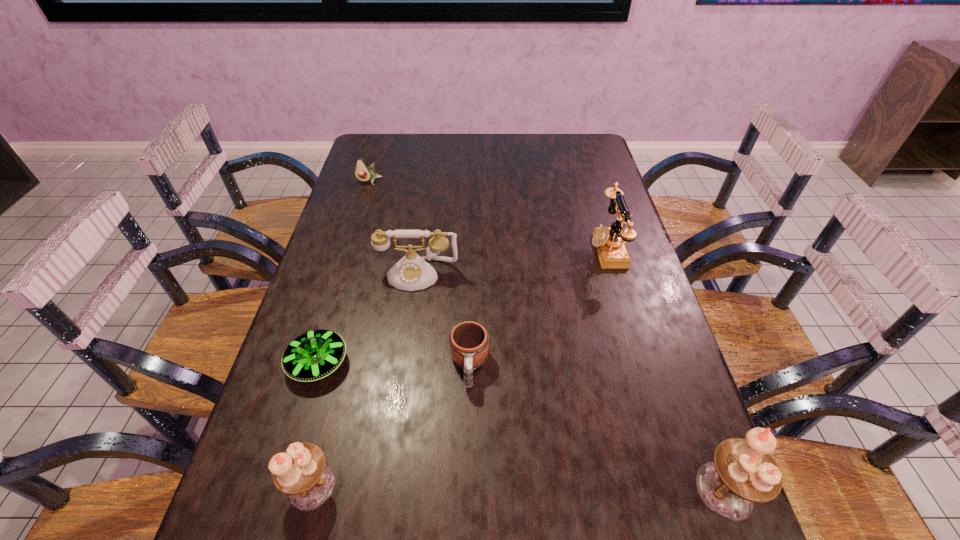
If the aim is uniform spacing by inserting an additional candle_holder among them, please point to a vacant space for this new candle_holder. Please provide its 2D coordinates. Your answer should be formatted as a tuple, i.e. [(x, y)], where the tuple contains the x and y coordinates of a point satisfying the conditions above.

[(517, 488)]